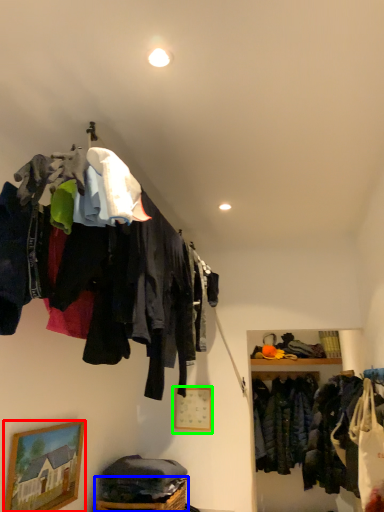
Question: Which object is positioned farthest from picture frame (highlighted by a red box)? Select from basket (highlighted by a blue box) and picture frame (highlighted by a green box).

Choices:
 (A) basket
 (B) picture frame

Answer: (B)